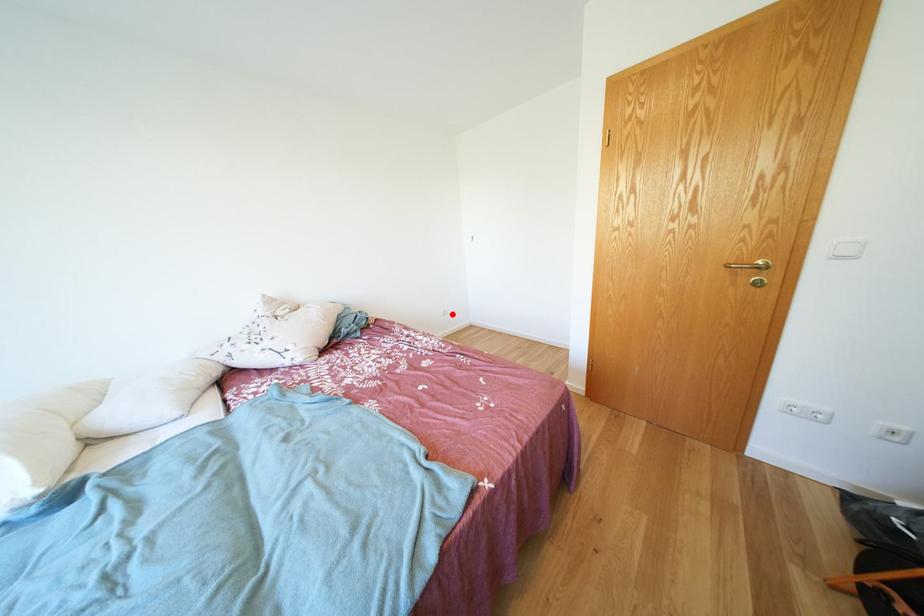
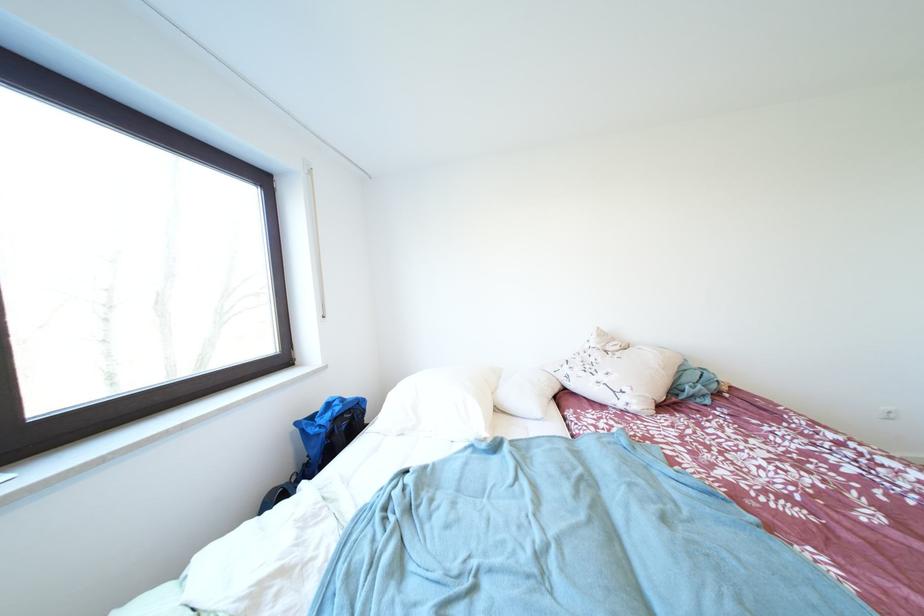
Question: I am providing you with two images of the same scene from different viewpoints. In image1, a red point is highlighted. Considering the same 3D point in image2, which of the following is correct?

Choices:
 (A) It is closer
 (B) It is farther

Answer: (A)